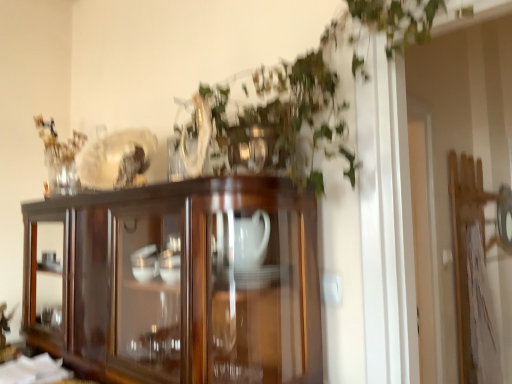
Find the location of a particular element. dark wood cupboard at center is located at coordinates (184, 283).

What is the approximate width of dark wood cupboard at center?

13.63 inches.

Image resolution: width=512 pixels, height=384 pixels. What do you see at coordinates (184, 283) in the screenshot?
I see `dark wood cupboard at center` at bounding box center [184, 283].

Describe the element at coordinates (316, 90) in the screenshot. This screenshot has width=512, height=384. I see `green leafy plant at upper center` at that location.

What are the coordinates of `green leafy plant at upper center` in the screenshot? It's located at click(316, 90).

Locate an element on the screen. The image size is (512, 384). dark wood cupboard at center is located at coordinates (184, 283).

Does dark wood cupboard at center appear on the left side of green leafy plant at upper center?

Yes, dark wood cupboard at center is to the left of green leafy plant at upper center.

Between dark wood cupboard at center and green leafy plant at upper center, which one is positioned behind?

dark wood cupboard at center.

Which is behind, point (233, 336) or point (349, 35)?

The point (233, 336) is more distant.

From the image's perspective, is dark wood cupboard at center positioned above or below green leafy plant at upper center?

dark wood cupboard at center is below green leafy plant at upper center.

From a real-world perspective, which object stands above the other?

In real-world perspective, green leafy plant at upper center is above.

Considering the relative sizes of dark wood cupboard at center and green leafy plant at upper center in the image provided, is dark wood cupboard at center thinner than green leafy plant at upper center?

Indeed, dark wood cupboard at center has a lesser width compared to green leafy plant at upper center.

Does dark wood cupboard at center have a lesser height compared to green leafy plant at upper center?

Correct, dark wood cupboard at center is not as tall as green leafy plant at upper center.

Considering the sizes of objects dark wood cupboard at center and green leafy plant at upper center in the image provided, who is smaller, dark wood cupboard at center or green leafy plant at upper center?

green leafy plant at upper center.

Is dark wood cupboard at center situated inside green leafy plant at upper center or outside?

The correct answer is: outside.

Are dark wood cupboard at center and green leafy plant at upper center far apart?

dark wood cupboard at center is near green leafy plant at upper center, not far away.

Is dark wood cupboard at center oriented away from green leafy plant at upper center?

No, dark wood cupboard at center is not facing the opposite direction of green leafy plant at upper center.

What's the angular difference between dark wood cupboard at center and green leafy plant at upper center's facing directions?

The angular difference between dark wood cupboard at center and green leafy plant at upper center is 0.816 degrees.

At what (x,y) coordinates should I click in order to perform the action: click on vegetation above the dark wood cupboard at center (from the image's perspective). Please return your answer as a coordinate pair (x, y). The image size is (512, 384). Looking at the image, I should click on (316, 90).

Visually, is green leafy plant at upper center positioned to the left or to the right of dark wood cupboard at center?

In the image, green leafy plant at upper center appears on the right side of dark wood cupboard at center.

Between green leafy plant at upper center and dark wood cupboard at center, which one is positioned in front?

green leafy plant at upper center is closer to the camera.

Which is behind, point (324, 124) or point (125, 328)?

The point (125, 328) is more distant.

From the image's perspective, does green leafy plant at upper center appear higher than dark wood cupboard at center?

Indeed, from the image's perspective, green leafy plant at upper center is shown above dark wood cupboard at center.

From a real-world perspective, which object stands above the other?

In real-world perspective, green leafy plant at upper center is above.

Can you confirm if green leafy plant at upper center is wider than dark wood cupboard at center?

Correct, the width of green leafy plant at upper center exceeds that of dark wood cupboard at center.

Consider the image. Which of these two, green leafy plant at upper center or dark wood cupboard at center, stands taller?

green leafy plant at upper center.

Is green leafy plant at upper center smaller than dark wood cupboard at center?

Yes, green leafy plant at upper center is smaller than dark wood cupboard at center.

Is dark wood cupboard at center completely or partially inside green leafy plant at upper center?

Actually, dark wood cupboard at center is outside green leafy plant at upper center.

Is green leafy plant at upper center placed right next to dark wood cupboard at center?

green leafy plant at upper center and dark wood cupboard at center are clearly separated.

Is green leafy plant at upper center positioned with its back to dark wood cupboard at center?

That's not correct — green leafy plant at upper center is not looking away from dark wood cupboard at center.

How many degrees apart are the facing directions of green leafy plant at upper center and dark wood cupboard at center?

0.816 degrees separate the facing orientations of green leafy plant at upper center and dark wood cupboard at center.

How distant is green leafy plant at upper center from dark wood cupboard at center?

The distance of green leafy plant at upper center from dark wood cupboard at center is 14.46 inches.

This screenshot has width=512, height=384. Find the location of `vegetation above the dark wood cupboard at center (from the image's perspective)`. vegetation above the dark wood cupboard at center (from the image's perspective) is located at coordinates (316, 90).

You are a GUI agent. You are given a task and a screenshot of the screen. Output one action in this format:
    pyautogui.click(x=<x>, y=<y>)
    Task: Click on the vegetation to the right of dark wood cupboard at center
    This screenshot has height=384, width=512.
    Given the screenshot: What is the action you would take?
    click(316, 90)

Identify the location of cupboard below the green leafy plant at upper center (from the image's perspective). (184, 283).